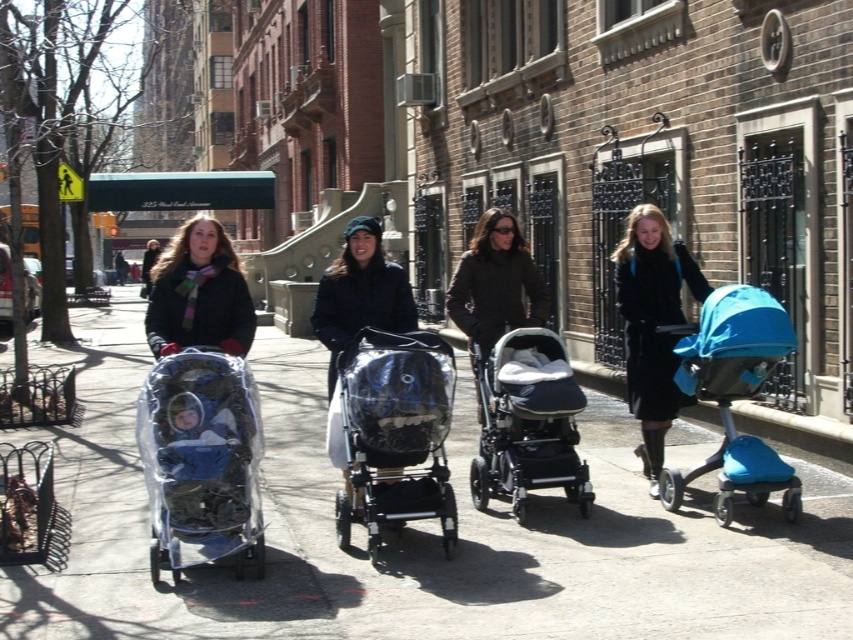
Is teal fabric stroller at right below black textured stroller at center?

Incorrect, teal fabric stroller at right is not positioned below black textured stroller at center.

Does teal fabric stroller at right come behind black textured stroller at center?

No, it is in front of black textured stroller at center.

Is point (737, 388) positioned after point (589, 477)?

No, (737, 388) is in front of (589, 477).

This screenshot has height=640, width=853. I want to click on teal fabric stroller at right, so click(x=733, y=394).

Who is shorter, teal fabric stroller at right or matte black coat at center?

teal fabric stroller at right is shorter.

Locate an element on the screen. The height and width of the screenshot is (640, 853). teal fabric stroller at right is located at coordinates (733, 394).

Measure the distance between teal fabric stroller at right and camera.

teal fabric stroller at right and camera are 18.11 feet apart.

This screenshot has width=853, height=640. In order to click on teal fabric stroller at right in this screenshot , I will do `click(733, 394)`.

Is clear concrete sidewalk at center above transparent plastic stroller at left?

Actually, clear concrete sidewalk at center is below transparent plastic stroller at left.

Between point (822, 577) and point (178, 524), which one is positioned behind?

The point (178, 524) is more distant.

Is point (659, 589) less distant than point (241, 461)?

Yes, it is.

Where is `clear concrete sidewalk at center`? Image resolution: width=853 pixels, height=640 pixels. clear concrete sidewalk at center is located at coordinates (413, 532).